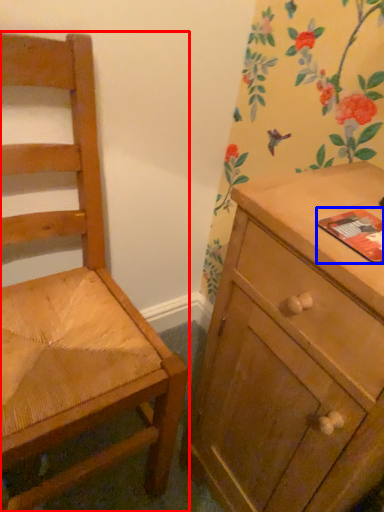
Question: Which of the following is the farthest to the observer, chair (highlighted by a red box) or paperback book (highlighted by a blue box)?

Choices:
 (A) chair
 (B) paperback book

Answer: (B)